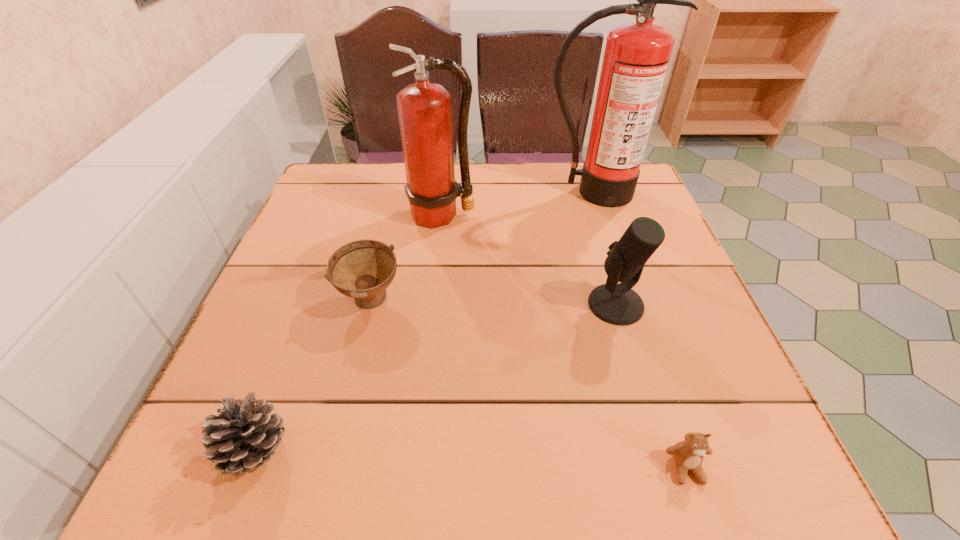
What are the coordinates of `vacant space located on the left of the microphone` in the screenshot? It's located at (434, 305).

The width and height of the screenshot is (960, 540). I want to click on blank space located on the right of the soup bowl, so click(x=551, y=301).

The image size is (960, 540). Find the location of `free spot located 0.250m on the back of the leftmost object`. free spot located 0.250m on the back of the leftmost object is located at coordinates click(x=311, y=303).

At what (x,y) coordinates should I click in order to perform the action: click on pinecone that is at the near edge. Please return your answer as a coordinate pair (x, y). This screenshot has width=960, height=540. Looking at the image, I should click on (243, 436).

Identify the location of teddy bear that is at the near edge. (688, 455).

Where is `soup bowl situated at the left edge`? The image size is (960, 540). soup bowl situated at the left edge is located at coordinates (363, 269).

Where is `pinecone at the left edge`? pinecone at the left edge is located at coordinates (243, 436).

Find the location of a particular element. Image resolution: width=960 pixels, height=540 pixels. fire extinguisher present at the right edge is located at coordinates (636, 57).

Identify the location of microphone that is positioned at the right edge. (617, 304).

The width and height of the screenshot is (960, 540). Identify the location of teddy bear present at the right edge. (688, 455).